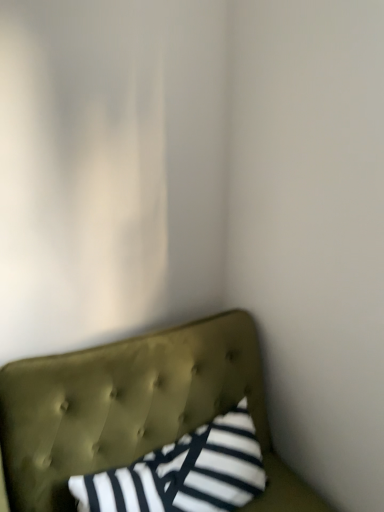
Question: From a real-world perspective, relative to striped fabric pillow at center, is tufted olive green headboard at lower left vertically above or below?

Choices:
 (A) below
 (B) above

Answer: (A)

Question: Considering the positions of tufted olive green headboard at lower left and striped fabric pillow at center in the image, is tufted olive green headboard at lower left wider or thinner than striped fabric pillow at center?

Choices:
 (A) thin
 (B) wide

Answer: (B)

Question: Is tufted olive green headboard at lower left to the left or to the right of striped fabric pillow at center in the image?

Choices:
 (A) right
 (B) left

Answer: (A)

Question: Is striped fabric pillow at center bigger or smaller than tufted olive green headboard at lower left?

Choices:
 (A) big
 (B) small

Answer: (B)

Question: Considering the positions of striped fabric pillow at center and tufted olive green headboard at lower left in the image, is striped fabric pillow at center wider or thinner than tufted olive green headboard at lower left?

Choices:
 (A) wide
 (B) thin

Answer: (B)

Question: From the image's perspective, is striped fabric pillow at center positioned above or below tufted olive green headboard at lower left?

Choices:
 (A) above
 (B) below

Answer: (A)

Question: Is striped fabric pillow at center taller or shorter than tufted olive green headboard at lower left?

Choices:
 (A) tall
 (B) short

Answer: (B)